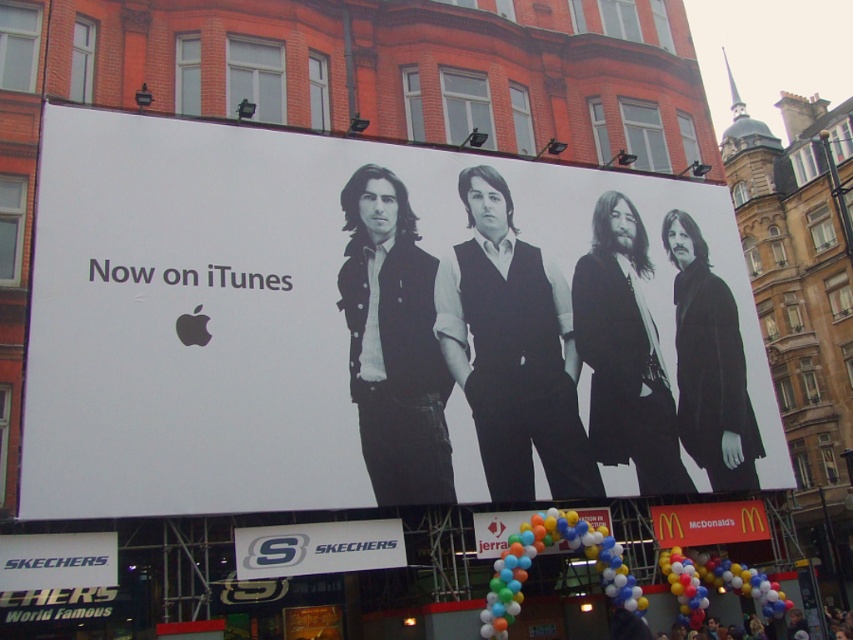
Can you confirm if white plastic mcdonald's sign at lower right is positioned above balloon bouquet at lower center?

No, white plastic mcdonald's sign at lower right is not above balloon bouquet at lower center.

Based on the photo, who is positioned more to the right, white plastic mcdonald's sign at lower right or balloon bouquet at lower center?

white plastic mcdonald's sign at lower right

Consider the image. Who is more distant from viewer, [666,545] or [515,531]?

Positioned behind is point [666,545].

Identify the location of white plastic mcdonald's sign at lower right. This screenshot has width=853, height=640. (709, 522).

Which is behind, point (270, 550) or point (608, 508)?

Point (608, 508)

Which is in front, point (294, 541) or point (518, 531)?

Positioned in front is point (294, 541).

Locate an element on the screen. This screenshot has height=640, width=853. white fabric sign at center is located at coordinates (318, 547).

Measure the distance from white fabric sign at center to white plastic mcdonald's sign at lower right.

white fabric sign at center is 24.80 meters from white plastic mcdonald's sign at lower right.

In the scene shown: Is white fabric sign at center to the right of white plastic mcdonald's sign at lower right from the viewer's perspective?

Incorrect, white fabric sign at center is not on the right side of white plastic mcdonald's sign at lower right.

What do you see at coordinates (318, 547) in the screenshot? Image resolution: width=853 pixels, height=640 pixels. I see `white fabric sign at center` at bounding box center [318, 547].

I want to click on white fabric sign at center, so click(318, 547).